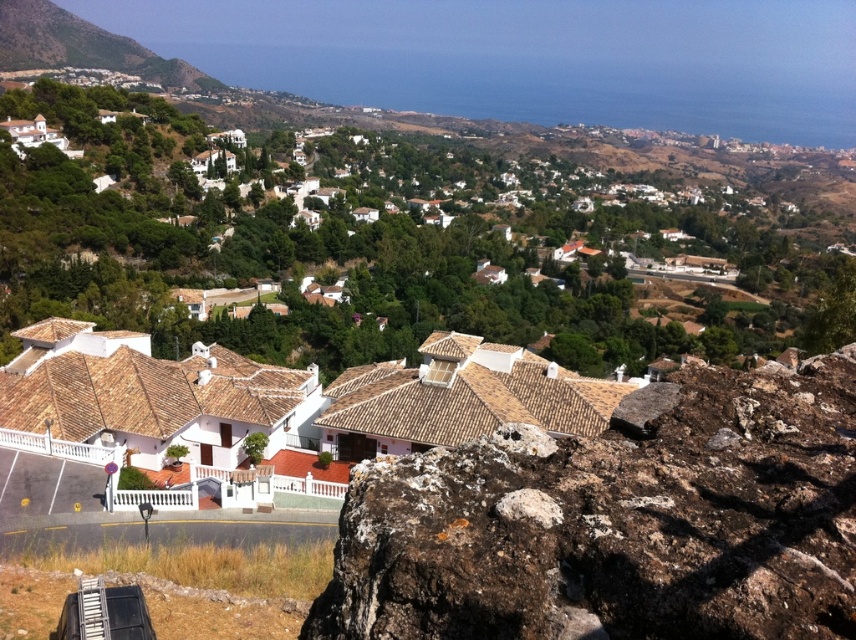
Question: Is brown rough rock at lower right smaller than green grassy hillside at upper left?

Choices:
 (A) no
 (B) yes

Answer: (B)

Question: Is brown rough rock at lower right smaller than green grassy hillside at upper left?

Choices:
 (A) no
 (B) yes

Answer: (B)

Question: Is brown rough rock at lower right above white tile roof houses at lower left?

Choices:
 (A) no
 (B) yes

Answer: (B)

Question: Which of the following is the farthest from the observer?

Choices:
 (A) green grassy hillside at upper left
 (B) white tile roof houses at lower left

Answer: (A)

Question: Which point is closer to the camera?

Choices:
 (A) white tile roof houses at lower left
 (B) brown rough rock at lower right
 (C) green grassy hillside at upper left

Answer: (B)

Question: Among these points, which one is farthest from the camera?

Choices:
 (A) tap(153, 384)
 (B) tap(68, 33)
 (C) tap(752, 412)

Answer: (B)